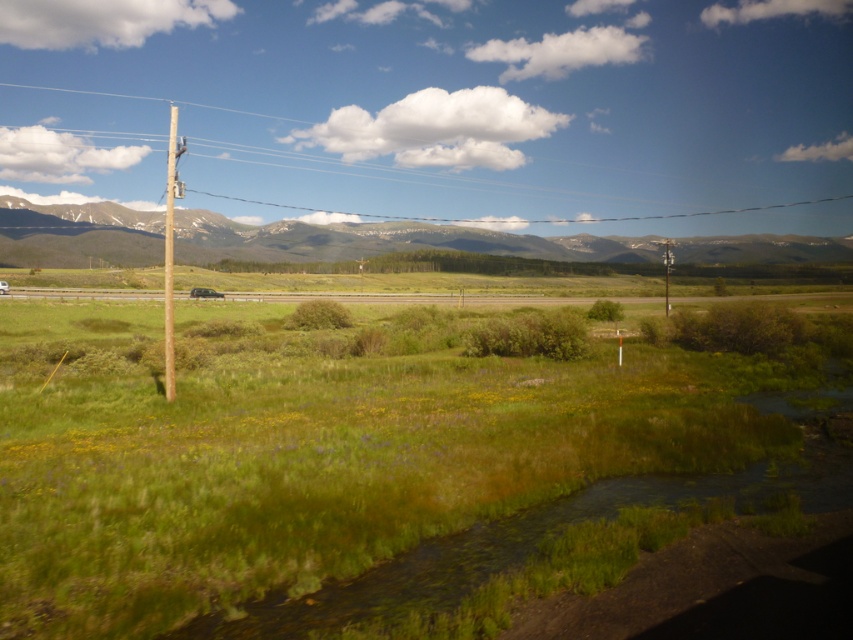
You are a hiker planning to take a photo of the snowy rock mountain range at upper center. The camera you are using has a focal length of 50mm. If you want to capture the entire mountain range in your photo, which direction should you move your camera to ensure the mountain range fits within the frame?

The snowy rock mountain range at upper center is positioned at point coordinates of (383, 241). To capture the entire mountain range within the frame, you should adjust your camera to center it on those coordinates, ensuring the mountain range is framed properly.

You are a photographer setting up a tripod to capture the mountains in the background. You notice the brown wooden pole at upper left and the metallic gray telegraph pole at left in your viewfinder. Which pole will appear closer to the top of your photo frame?

The brown wooden pole at upper left will appear closer to the top of the photo frame because it is positioned over the metallic gray telegraph pole at left.

You are a photographer planning to capture a landscape shot that includes both the brown wooden telegraph pole at left and the matte black suv at center. Based on their sizes in the image, which object would appear wider in the photo?

The brown wooden telegraph pole at left appears wider in the photo because its width is larger than that of the matte black suv at center.